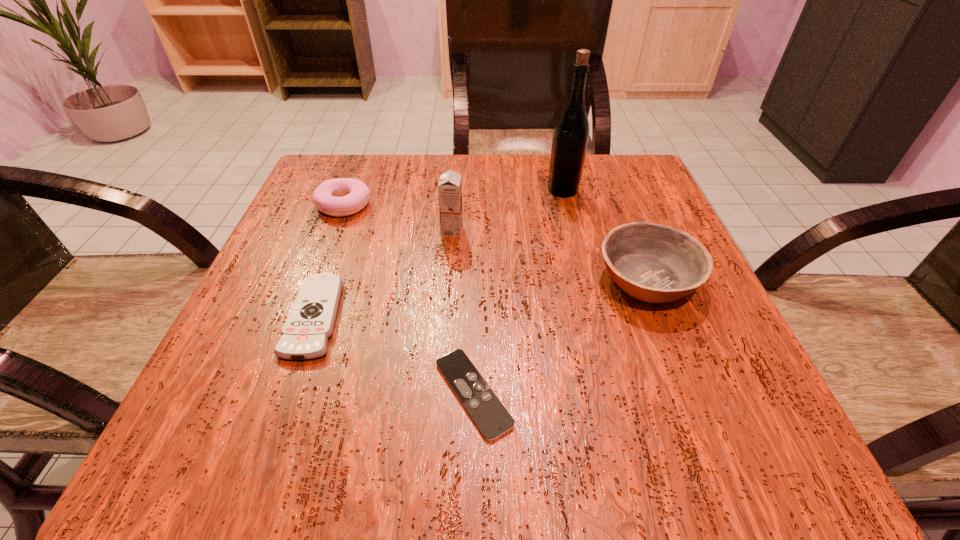
In order to click on vacant space situated 0.280m on the front of the third farthest object in this screenshot , I will do `click(443, 355)`.

At what (x,y) coordinates should I click in order to perform the action: click on vacant space situated 0.070m on the front of the fourth shortest object. Please return your answer as a coordinate pair (x, y). Looking at the image, I should click on (676, 354).

Find the location of `vacant space located 0.200m on the right of the third shortest object`. vacant space located 0.200m on the right of the third shortest object is located at coordinates (466, 205).

I want to click on free spot located 0.340m on the back of the left remote control, so click(365, 176).

Image resolution: width=960 pixels, height=540 pixels. Find the location of `vacant area situated on the right of the shorter remote control`. vacant area situated on the right of the shorter remote control is located at coordinates (613, 393).

This screenshot has height=540, width=960. Find the location of `beer bottle at the far edge`. beer bottle at the far edge is located at coordinates (570, 139).

You are a GUI agent. You are given a task and a screenshot of the screen. Output one action in this format:
    pyautogui.click(x=<x>, y=<y>)
    Task: Click on the pastry at the far edge
    
    Given the screenshot: What is the action you would take?
    pyautogui.click(x=342, y=196)

Where is `object located in the near edge section of the desktop`? object located in the near edge section of the desktop is located at coordinates (491, 417).

Locate an element on the screen. pastry that is at the left edge is located at coordinates (342, 196).

At what (x,y) coordinates should I click in order to perform the action: click on remote control located in the left edge section of the desktop. Please return your answer as a coordinate pair (x, y). Image resolution: width=960 pixels, height=540 pixels. Looking at the image, I should click on [310, 323].